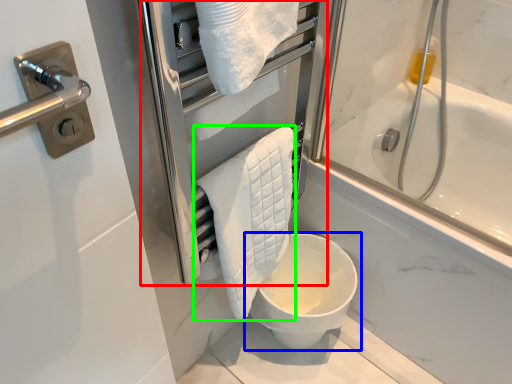
Question: Estimate the real-world distances between objects in this image. Which object is farther from screen door (highlighted by a red box), toilet (highlighted by a blue box) or bath towel (highlighted by a green box)?

Choices:
 (A) toilet
 (B) bath towel

Answer: (A)